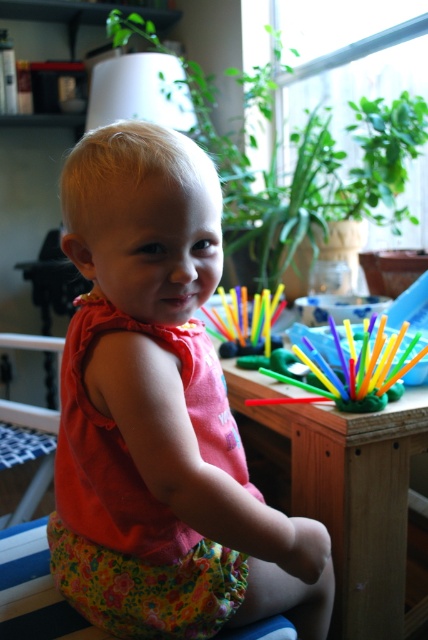
Question: Which object appears closest to the camera in this image?

Choices:
 (A) multicolored plastic straws at center
 (B) floral fabric chair at lower left
 (C) pink fabric dress at center

Answer: (C)

Question: Can you confirm if multicolored plastic straws at center is positioned below floral fabric chair at lower left?

Choices:
 (A) no
 (B) yes

Answer: (A)

Question: Which of the following is the farthest from the observer?

Choices:
 (A) multicolored plastic straws at center
 (B) pink fabric dress at center
 (C) wooden table at center
 (D) floral fabric chair at lower left

Answer: (D)

Question: Which object is the farthest from the multicolored plastic straws at center?

Choices:
 (A) floral fabric chair at lower left
 (B) wooden table at center
 (C) pink fabric dress at center

Answer: (A)

Question: Does pink fabric dress at center lie in front of floral fabric chair at lower left?

Choices:
 (A) yes
 (B) no

Answer: (A)

Question: Observing the image, what is the correct spatial positioning of multicolored plastic straws at center in reference to floral fabric chair at lower left?

Choices:
 (A) below
 (B) above

Answer: (B)